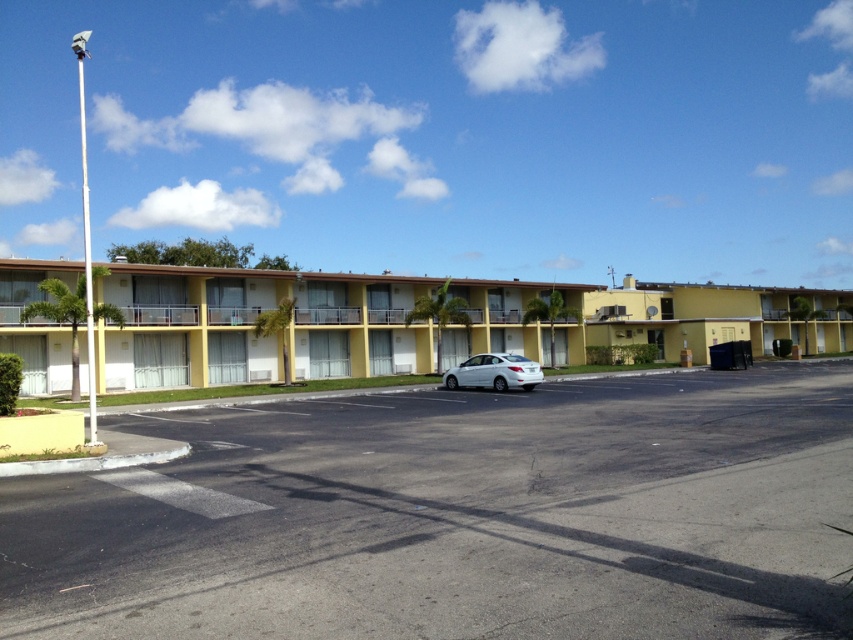
Can you confirm if black asphalt parking lot at center is taller than white glossy sedan at center?

In fact, black asphalt parking lot at center may be shorter than white glossy sedan at center.

Is black asphalt parking lot at center wider than white glossy sedan at center?

Correct, the width of black asphalt parking lot at center exceeds that of white glossy sedan at center.

Where is `black asphalt parking lot at center`? Image resolution: width=853 pixels, height=640 pixels. black asphalt parking lot at center is located at coordinates (457, 516).

Is yellow matte building at center shorter than white glossy sedan at center?

Incorrect, yellow matte building at center's height does not fall short of white glossy sedan at center's.

Is point (173, 340) farther from camera compared to point (462, 368)?

That is True.

Which is behind, point (361, 352) or point (457, 385)?

The point (361, 352) is behind.

Locate an element on the screen. The image size is (853, 640). yellow matte building at center is located at coordinates (252, 323).

Who is shorter, black asphalt parking lot at center or yellow matte building at center?

Standing shorter between the two is black asphalt parking lot at center.

Who is more forward, (663, 426) or (160, 285)?

Positioned in front is point (663, 426).

Locate an element on the screen. The image size is (853, 640). black asphalt parking lot at center is located at coordinates (457, 516).